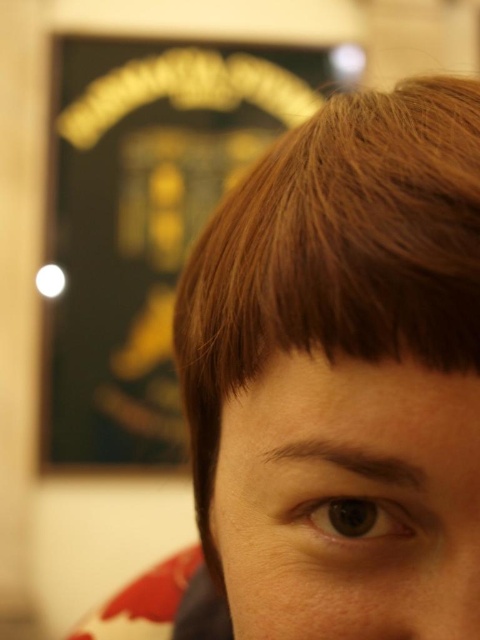
You are taking a photo of the person in the scene. You want to focus on the point that is closer to the camera. Which point should you choose between point (211,58) and point (444,604)?

Point (444,604) is closer to the camera than point (211,58), so you should choose point (444,604) to focus on.

You are a photographer trying to adjust the lighting for a portrait. You notice the subject has a brown matte hair at upper right marked by point (343,372). Where should you position the light to highlight the texture of the hair?

To highlight the texture of the brown matte hair at upper right marked by point (343,372), position the light source at an angle to the left of the hair. This creates shadows that emphasize the texture.

You are an interior designer assessing the lighting setup for a photo shoot. You notice the brown matte hair at upper right and the gold metallic sign at upper center in the frame. Which object appears smaller in the image?

The brown matte hair at upper right appears smaller than the gold metallic sign at upper center because it has a smaller size compared to it.